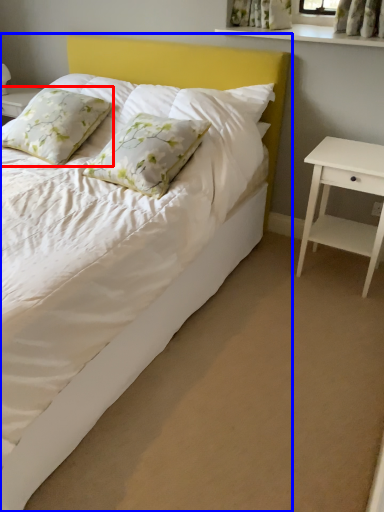
Question: Which object appears closest to the camera in this image, pillow (highlighted by a red box) or bed (highlighted by a blue box)?

Choices:
 (A) pillow
 (B) bed

Answer: (B)